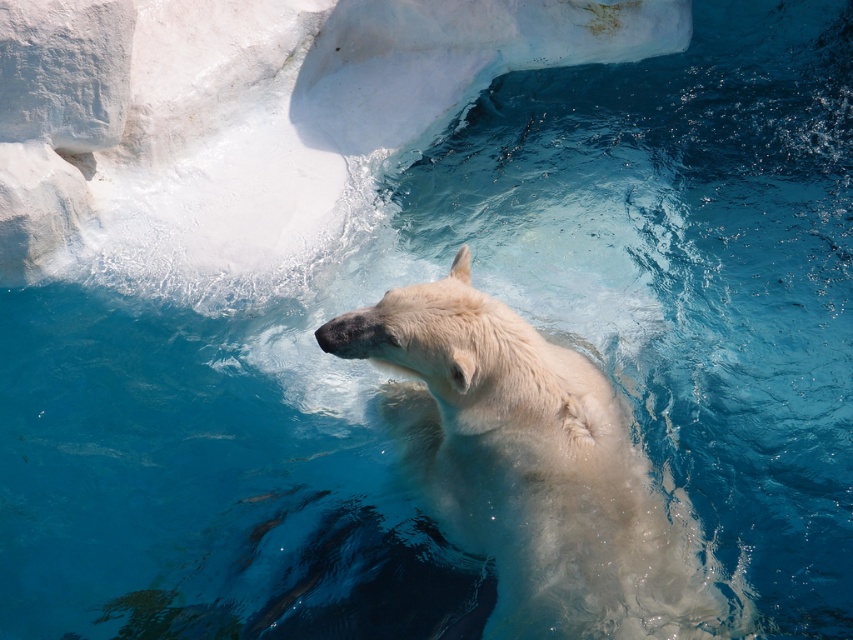
You are a zookeeper observing the polar bear exhibit. You notice the white fur bear at center and the white smooth rock at upper left. From your vantage point, which object is closer to you?

The white fur bear at center is closer to you because it is in front of the white smooth rock at upper left.

From the picture: You are a zookeeper observing the white fur bear at center and the white smooth rock at upper left. Which object is located to the right of the other?

The white fur bear at center is positioned on the right side of white smooth rock at upper left.